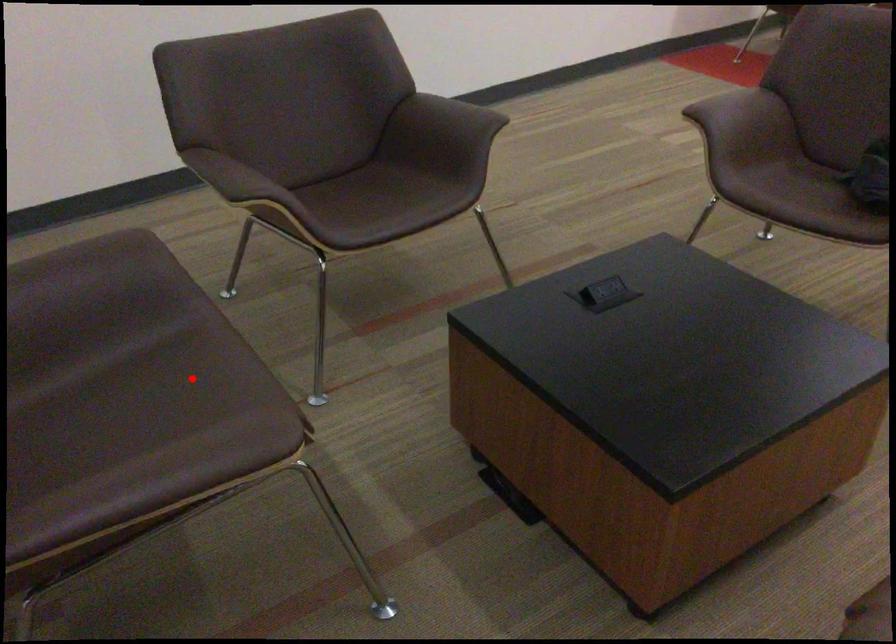
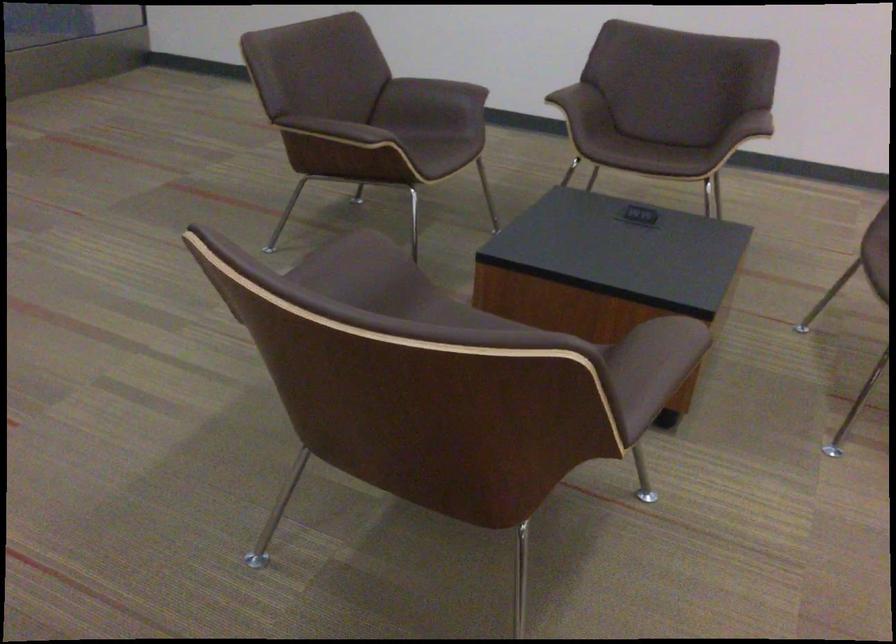
Find the pixel in the second image that matches the highlighted location in the first image.

(441, 151)